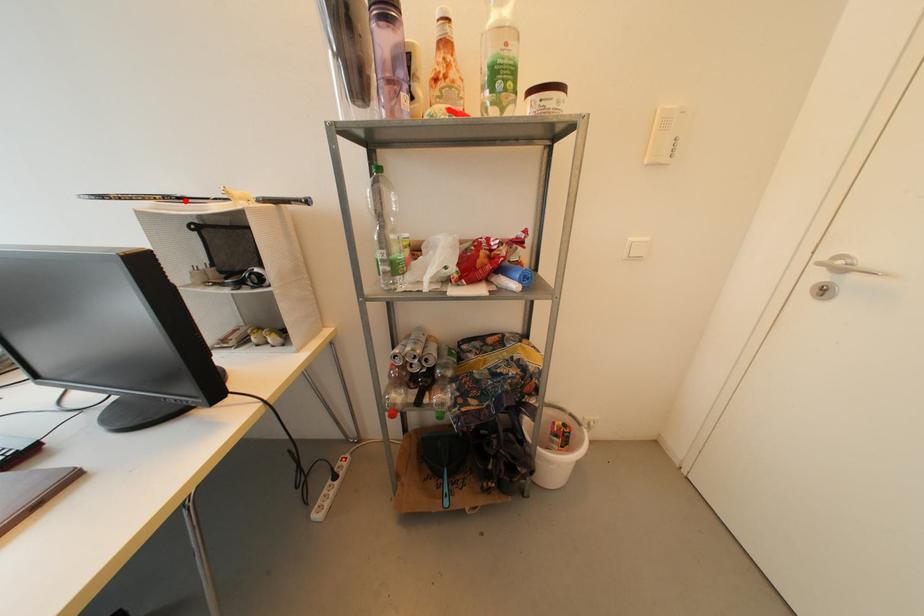
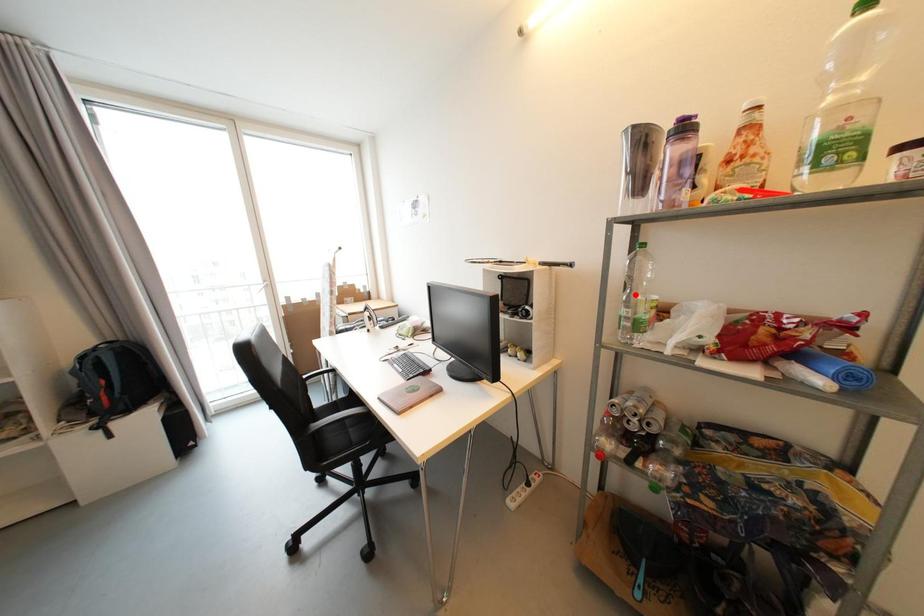
I am providing you with two images of the same scene from different viewpoints. A red point is marked on the first image and another point is marked on the second image. Are the points marked in image1 and image2 representing the same 3D position?

No